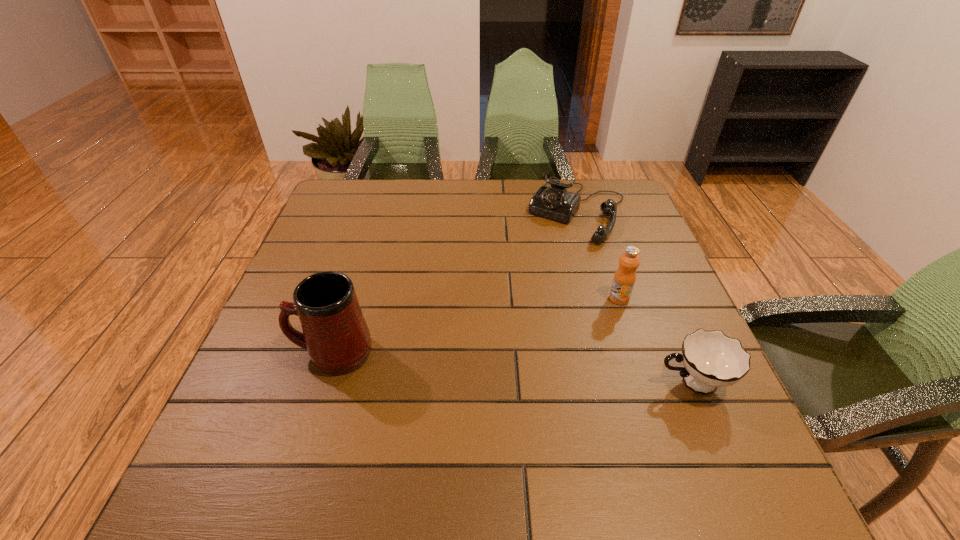
Where is `free spot located 0.400m on the side of the cup with the handle`? The height and width of the screenshot is (540, 960). free spot located 0.400m on the side of the cup with the handle is located at coordinates (452, 383).

Identify the location of vacant region located 0.220m on the side of the cup with the handle. (543, 383).

In order to click on free location located on the front label of the third nearest object in this screenshot , I will do `click(535, 377)`.

Locate an element on the screen. This screenshot has width=960, height=540. free location located 0.180m on the front label of the third nearest object is located at coordinates (567, 346).

This screenshot has height=540, width=960. Find the location of `vacant area situated on the front label of the third nearest object`. vacant area situated on the front label of the third nearest object is located at coordinates (562, 352).

Image resolution: width=960 pixels, height=540 pixels. In order to click on free space located 0.350m on the dial of the telephone in this screenshot , I will do [x=510, y=329].

Identify the location of free space located 0.130m on the dial of the telephone. The image size is (960, 540). (545, 271).

Identify the location of vacant space located on the dial of the telephone. The height and width of the screenshot is (540, 960). (552, 259).

Locate an element on the screen. object at the far edge is located at coordinates (555, 202).

Locate an element on the screen. The height and width of the screenshot is (540, 960). object that is at the near edge is located at coordinates (711, 359).